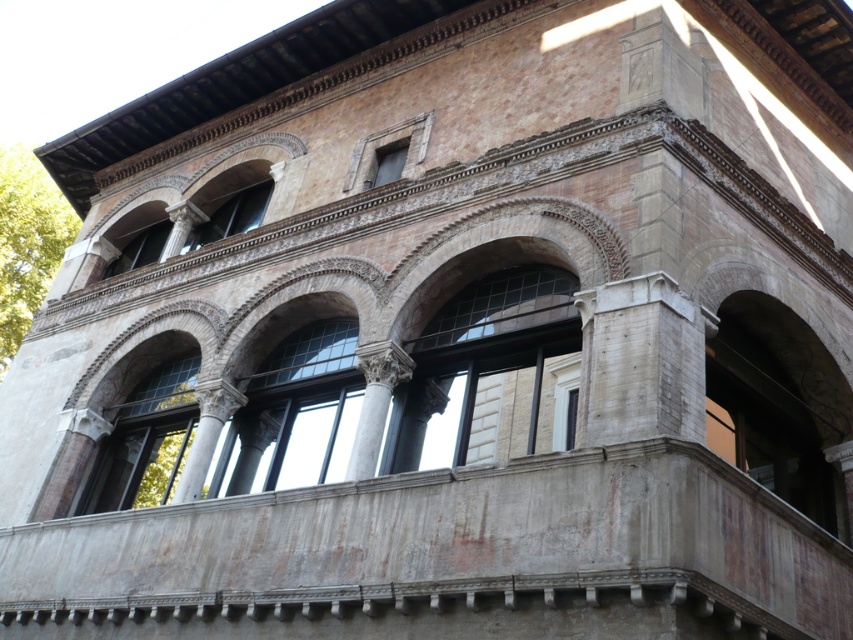
Question: Is clear glass window at center thinner than matte glass window at upper left?

Choices:
 (A) no
 (B) yes

Answer: (A)

Question: Which point is farther from the camera taking this photo?

Choices:
 (A) (329, 429)
 (B) (213, 230)
 (C) (390, 148)

Answer: (B)

Question: Estimate the real-world distances between objects in this image. Which object is closer to the matte glass window at upper left?

Choices:
 (A) clear glass window at center
 (B) matte stone window at upper center

Answer: (B)

Question: Does matte glass window at upper left appear on the right side of matte stone window at upper center?

Choices:
 (A) no
 (B) yes

Answer: (A)

Question: Among these objects, which one is nearest to the camera?

Choices:
 (A) matte glass window at upper center
 (B) clear glass window at center
 (C) matte stone window at upper center
 (D) matte glass window at upper left

Answer: (B)

Question: Does clear glass window at center have a lesser width compared to matte glass window at upper center?

Choices:
 (A) yes
 (B) no

Answer: (B)